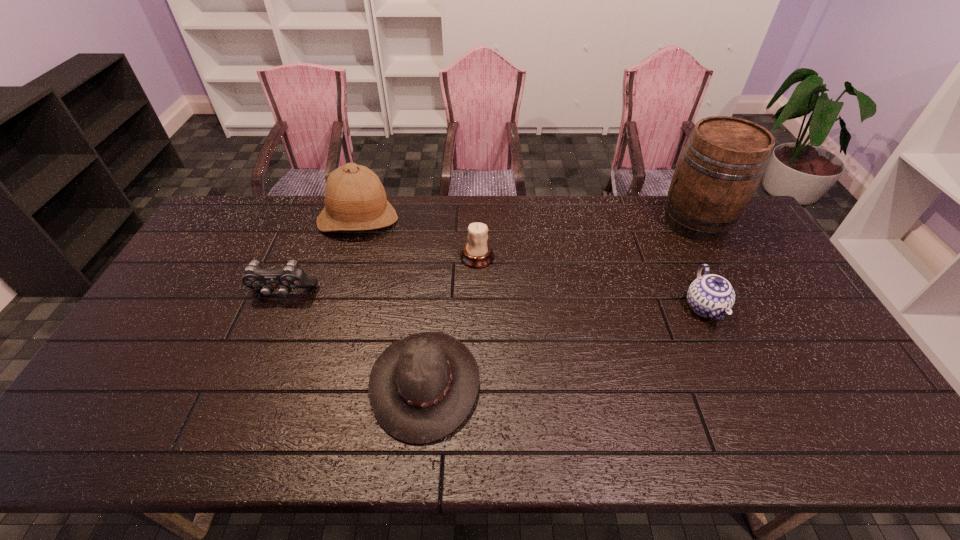
Where is `cider`? cider is located at coordinates (722, 163).

The image size is (960, 540). I want to click on the left hat, so click(x=355, y=199).

Locate an element on the screen. Image resolution: width=960 pixels, height=540 pixels. the taller hat is located at coordinates (355, 199).

Locate an element on the screen. This screenshot has width=960, height=540. candle holder is located at coordinates [477, 253].

At what (x,y) coordinates should I click in order to perform the action: click on control. Please return your answer as a coordinate pair (x, y). Image resolution: width=960 pixels, height=540 pixels. Looking at the image, I should click on (255, 277).

Image resolution: width=960 pixels, height=540 pixels. What are the coordinates of `chinaware` in the screenshot? It's located at (710, 295).

You are a GUI agent. You are given a task and a screenshot of the screen. Output one action in this format:
    pyautogui.click(x=<x>, y=<y>)
    Task: Click on the right hat
    This screenshot has width=960, height=540.
    Given the screenshot: What is the action you would take?
    pyautogui.click(x=421, y=388)

Where is `the shorter hat`? Image resolution: width=960 pixels, height=540 pixels. the shorter hat is located at coordinates (421, 388).

The height and width of the screenshot is (540, 960). What are the coordinates of `free region located on the side of the cider near the bung hole` in the screenshot? It's located at (632, 222).

The height and width of the screenshot is (540, 960). I want to click on vacant space situated on the side of the cider near the bung hole, so click(x=588, y=222).